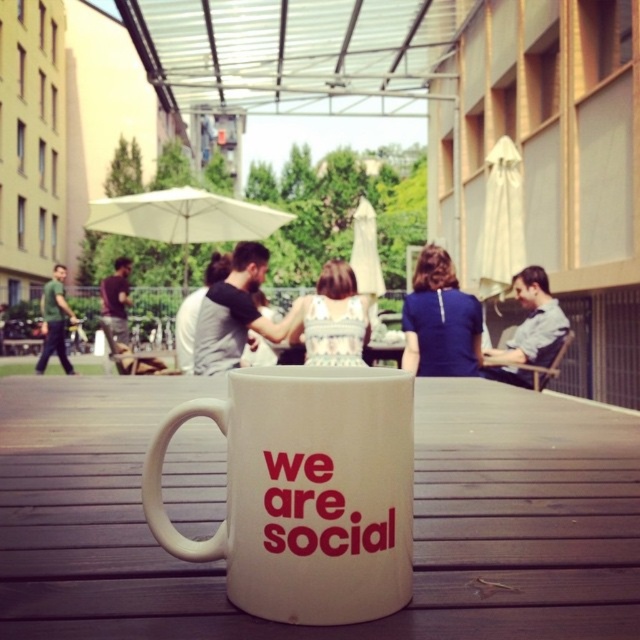
You are standing in this outdoor dining area and want to hand a menu to the person wearing the blue fabric shirt at center and the green cotton shirt at left. Which person will you approach first to ensure you can reach them without moving past others?

You should approach the blue fabric shirt at center first because it is closer to the viewer, so you can reach them without needing to move past others, whereas the green cotton shirt at left is further away.

You are a fashion designer observing a crowd at a social event. You notice two shirts at the center of the image. Which shirt is positioned higher between the blue fabric shirt at center and the light blue shirt at center?

The blue fabric shirt at center is positioned higher than the light blue shirt at center according to the description.